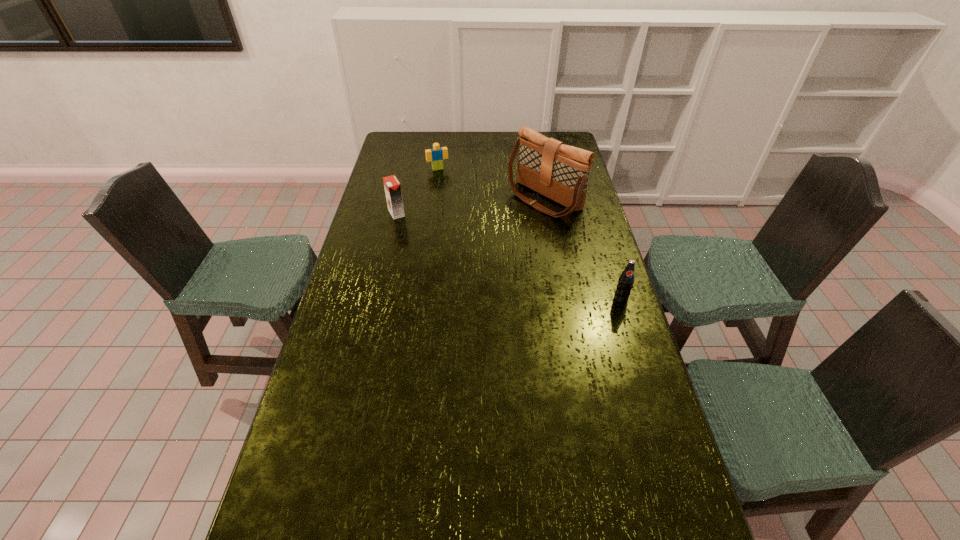
At what (x,y) coordinates should I click in order to perform the action: click on free region located 0.220m on the face of the Lego. Please return your answer as a coordinate pair (x, y). Looking at the image, I should click on (453, 198).

I want to click on free space located 0.070m on the face of the Lego, so click(444, 179).

Where is `vacant space situated 0.380m on the front-facing side of the shoulder bag`? The height and width of the screenshot is (540, 960). vacant space situated 0.380m on the front-facing side of the shoulder bag is located at coordinates tap(450, 260).

Image resolution: width=960 pixels, height=540 pixels. I want to click on vacant space located on the front-facing side of the shoulder bag, so click(x=464, y=252).

Locate an element on the screen. vacant point located 0.100m on the front-facing side of the shoulder bag is located at coordinates (503, 227).

Locate an element on the screen. Image resolution: width=960 pixels, height=540 pixels. object located in the left edge section of the desktop is located at coordinates (392, 186).

The image size is (960, 540). I want to click on pop at the right edge, so click(626, 280).

Find the location of a particular element. The image size is (960, 540). shoulder bag located at the right edge is located at coordinates (560, 172).

In the image, there is a desktop. At what (x,y) coordinates should I click in order to perform the action: click on blank space at the far edge. Please return your answer as a coordinate pair (x, y). Looking at the image, I should click on (513, 150).

Image resolution: width=960 pixels, height=540 pixels. Identify the location of free spot at the near edge of the desktop. (432, 511).